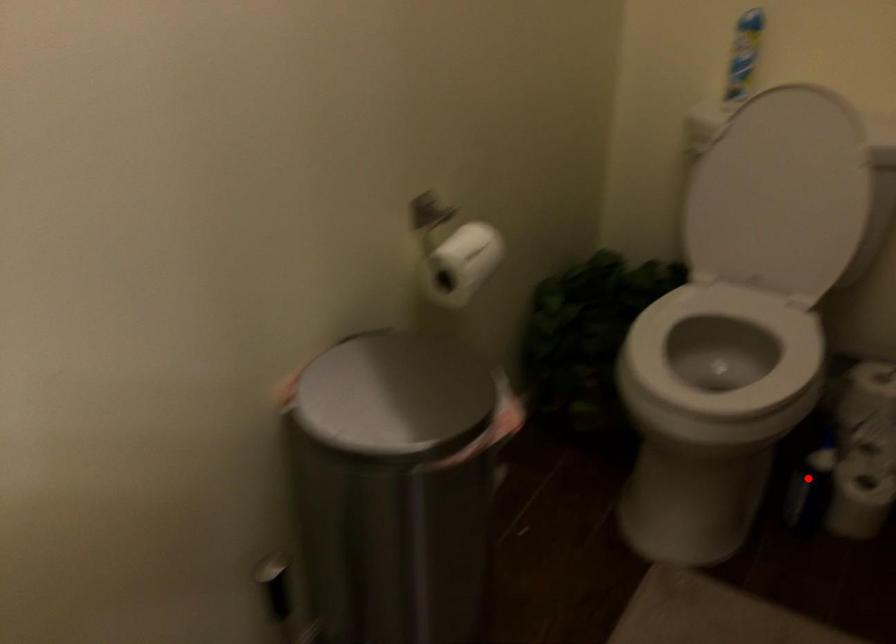
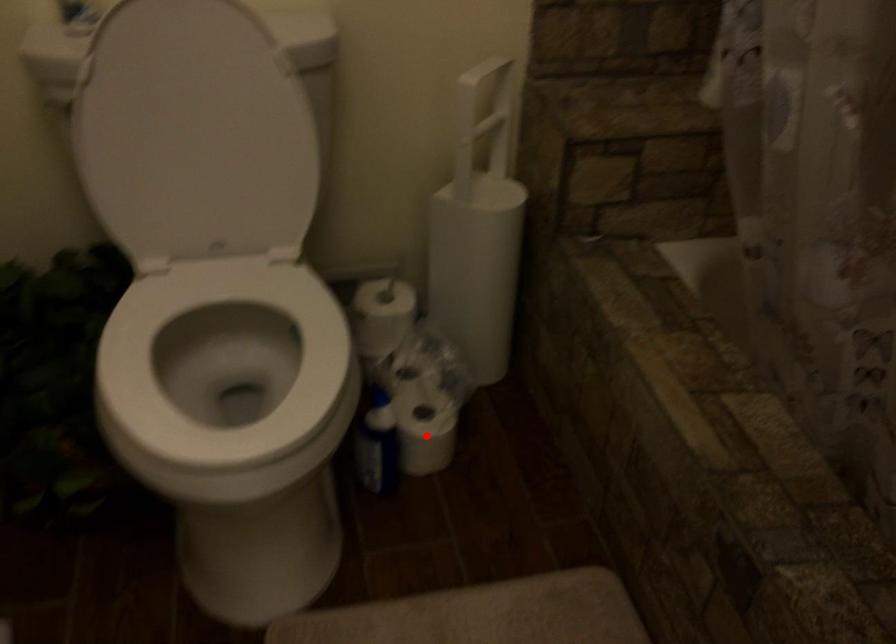
I am providing you with two images of the same scene from different viewpoints. A red point is marked on the first image and another point is marked on the second image. Is the red point in image1 aligned with the point shown in image2?

No